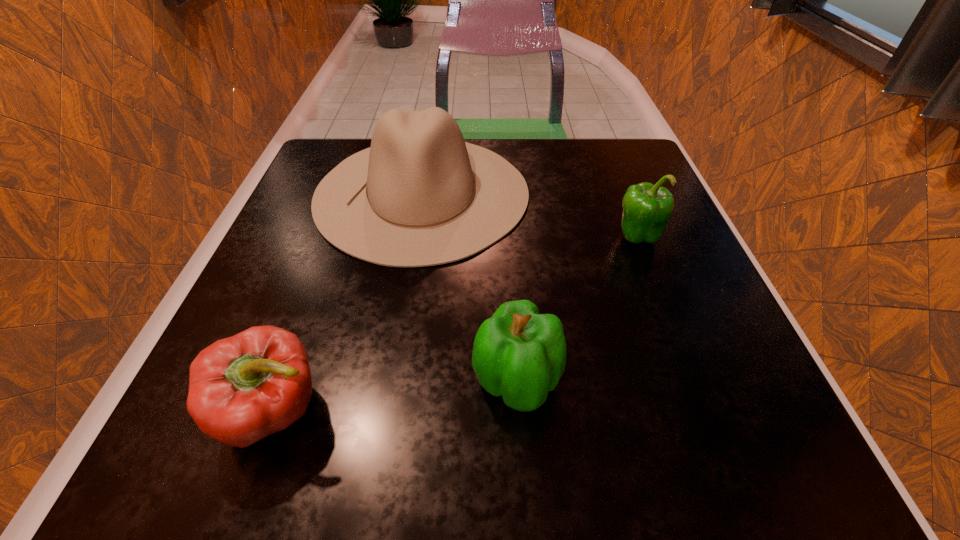
Where is `sombrero that is at the left edge`? Image resolution: width=960 pixels, height=540 pixels. sombrero that is at the left edge is located at coordinates (420, 196).

This screenshot has height=540, width=960. In order to click on bell pepper that is at the left edge in this screenshot , I will do `click(243, 388)`.

The image size is (960, 540). In order to click on object that is at the right edge in this screenshot , I will do `click(647, 208)`.

Find the location of `object that is at the far left corner`. object that is at the far left corner is located at coordinates (420, 196).

Locate an element on the screen. The width and height of the screenshot is (960, 540). object at the near left corner is located at coordinates [x=243, y=388].

In the image, there is a desktop. Identify the location of vacant area at the far edge. (560, 172).

You are a GUI agent. You are given a task and a screenshot of the screen. Output one action in this format:
    pyautogui.click(x=<x>, y=<y>)
    Task: Click on the vacant space at the near edge of the desktop
    Image resolution: width=960 pixels, height=540 pixels.
    Given the screenshot: What is the action you would take?
    pyautogui.click(x=456, y=452)

In the image, there is a desktop. At what (x,y) coordinates should I click in order to perform the action: click on vacant space at the left edge. Please return your answer as a coordinate pair (x, y). Looking at the image, I should click on (287, 242).

Find the location of a particular element. Image resolution: width=960 pixels, height=540 pixels. free spot at the right edge of the desktop is located at coordinates (605, 251).

Locate an element on the screen. The image size is (960, 540). vacant space at the far right corner is located at coordinates point(586,152).